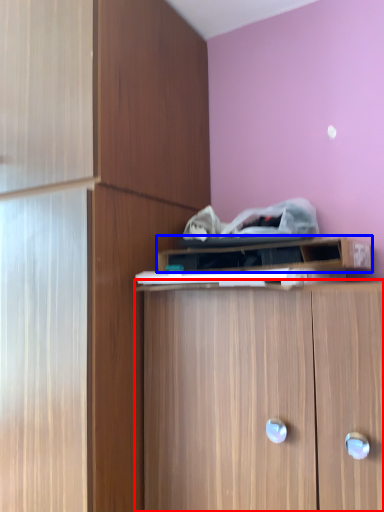
Question: Which object appears farthest to the camera in this image, cabinetry (highlighted by a red box) or cabinetry (highlighted by a blue box)?

Choices:
 (A) cabinetry
 (B) cabinetry

Answer: (B)